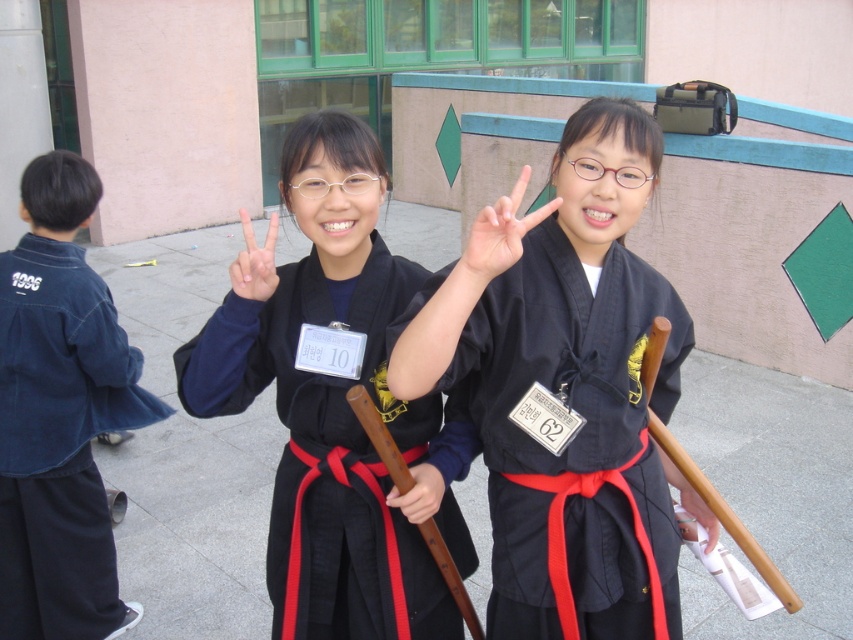
Question: Estimate the real-world distances between objects in this image. Which object is closer to the matte black hand at center?

Choices:
 (A) wooden stick at center
 (B) denim jacket at left

Answer: (B)

Question: Is matte black kimono at center thinner than matte black hand at center?

Choices:
 (A) no
 (B) yes

Answer: (A)

Question: Does black cotton karate uniform at center have a lesser width compared to denim jacket at left?

Choices:
 (A) no
 (B) yes

Answer: (A)

Question: Among these objects, which one is nearest to the camera?

Choices:
 (A) denim jacket at left
 (B) black cotton karate uniform at center
 (C) matte black kimono at center

Answer: (C)

Question: Is matte black kimono at center further to camera compared to wooden stick at center?

Choices:
 (A) no
 (B) yes

Answer: (A)

Question: Among these objects, which one is farthest from the camera?

Choices:
 (A) white matte hand at center
 (B) black cotton karate uniform at center
 (C) denim jacket at left

Answer: (C)